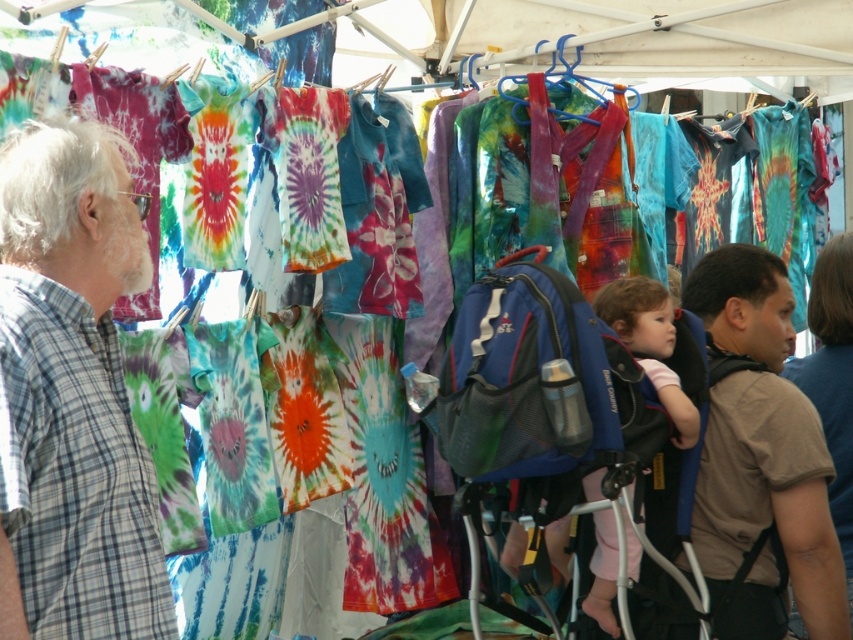
You are standing at the center of the display. The plaid shirt at left is located at coordinates point (73, 394). If you want to reach the plaid shirt at left, which direction should you move?

The plaid shirt at left is located at point (73, 394), so you should move to the left to reach it.